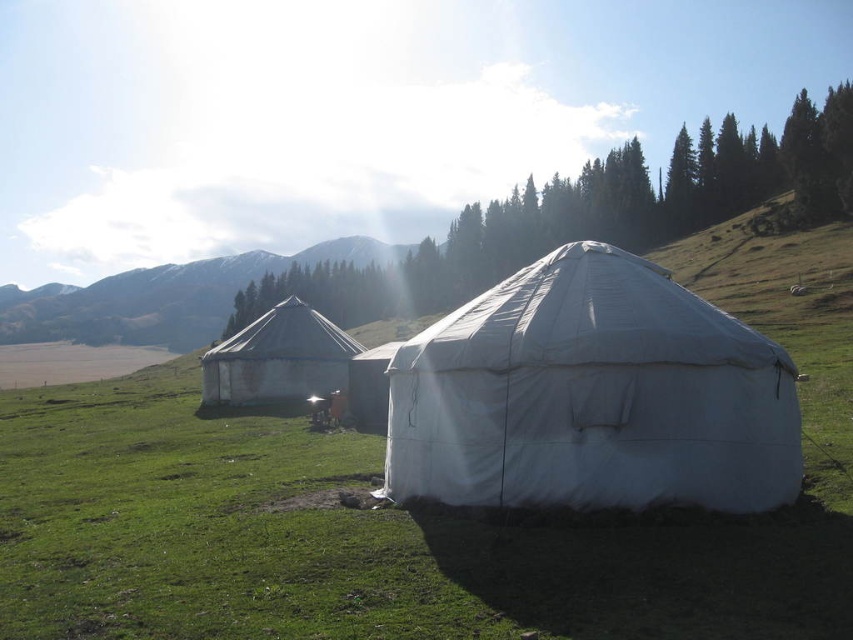
You are standing at the edge of a grassy plain and see two white tents in the distance. You need to determine which one is closer to you. The tents are labeled as the white canvas tent at center and the white fabric tent at center. Can you tell which one is nearer based on their positions?

The white canvas tent at center is 207.94 meters away from the white fabric tent at center. Since the distance between them is fixed, you cannot determine which one is closer to you without additional information about their positions relative to your location.

You are planning to set up a large tent in this landscape. Based on the image, which tent, the white fabric tent at center or the white canvas tent at left, would be more suitable for accommodating a group of 10 people?

The white fabric tent at center is much taller than the white canvas tent at left, making it more suitable for accommodating a group of 10 people due to its larger interior space.